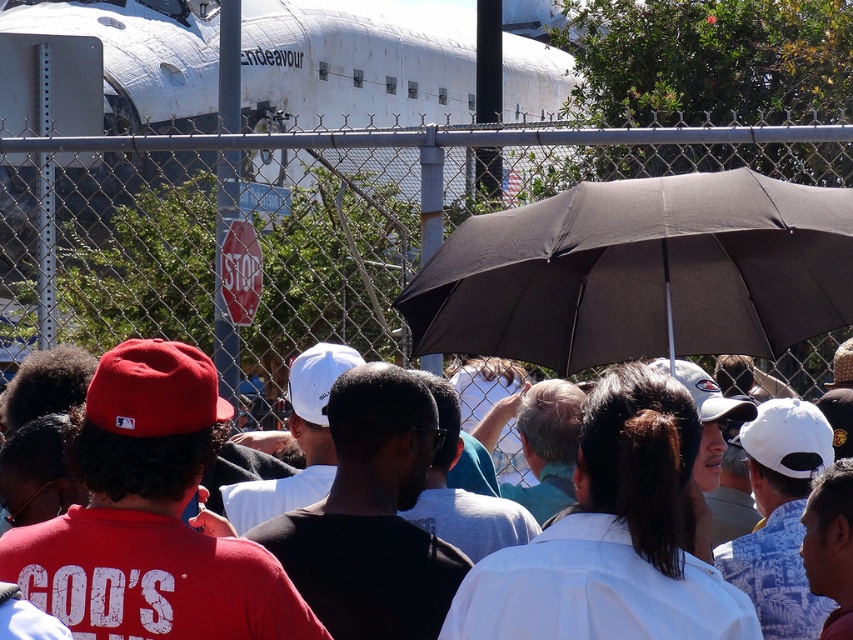
Is point (254, 374) more distant than point (432, 276)?

Yes.

Does point (733, 296) lie in front of point (714, 221)?

No, it is behind (714, 221).

The height and width of the screenshot is (640, 853). What are the coordinates of `metallic chain-link fence at center` in the screenshot? It's located at (436, 246).